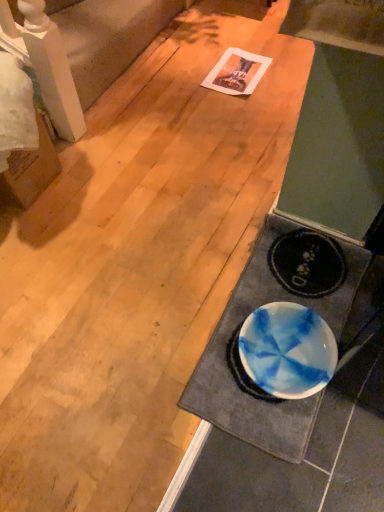
Find the location of a particular element. The width and height of the screenshot is (384, 512). unoccupied area in front of white glossy bowl at lower right is located at coordinates (286, 458).